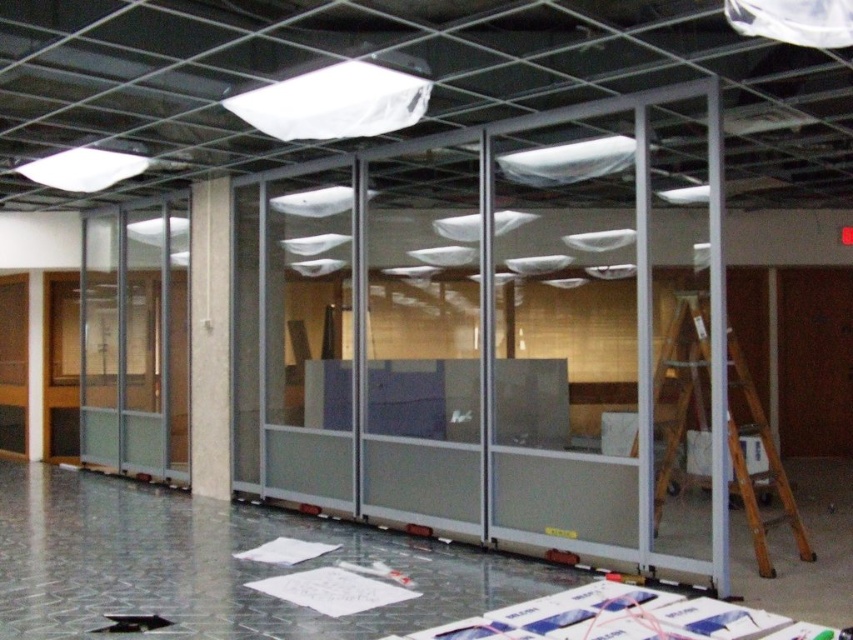
Question: Is white marble pillar at center to the right of white matte paper at lower center from the viewer's perspective?

Choices:
 (A) yes
 (B) no

Answer: (B)

Question: Is wooden ladder at right smaller than white marble pillar at center?

Choices:
 (A) yes
 (B) no

Answer: (B)

Question: Based on their relative distances, which object is nearer to the white matte paper at lower center?

Choices:
 (A) wooden ladder at right
 (B) white marble pillar at center

Answer: (B)

Question: Which object is positioned farthest from the white matte paper at lower center?

Choices:
 (A) white marble pillar at center
 (B) wooden ladder at right

Answer: (B)

Question: Can you confirm if white marble pillar at center is positioned below white matte paper at lower center?

Choices:
 (A) no
 (B) yes

Answer: (A)

Question: Among these points, which one is nearest to the camera?

Choices:
 (A) (740, 376)
 (B) (277, 561)
 (C) (201, 211)

Answer: (A)